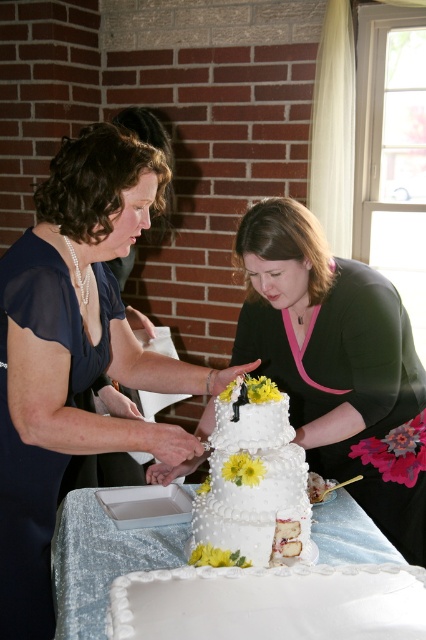
Question: Which object is farther from the camera taking this photo?

Choices:
 (A) white textured wedding cake at center
 (B) matte blue dress at center

Answer: (B)

Question: Which of the following is the farthest from the observer?

Choices:
 (A) matte black dress at center
 (B) white textured wedding cake at center

Answer: (A)

Question: Considering the relative positions of matte blue dress at center and matte black dress at center in the image provided, where is matte blue dress at center located with respect to matte black dress at center?

Choices:
 (A) above
 (B) below

Answer: (A)

Question: Considering the real-world distances, which object is farthest from the white sequined tablecloth at center?

Choices:
 (A) matte black dress at center
 (B) matte blue dress at center
 (C) white textured wedding cake at center

Answer: (A)

Question: Considering the relative positions of matte blue dress at center and white sequined tablecloth at center in the image provided, where is matte blue dress at center located with respect to white sequined tablecloth at center?

Choices:
 (A) below
 (B) above

Answer: (B)

Question: Can you confirm if matte black dress at center is positioned below white sequined tablecloth at center?

Choices:
 (A) no
 (B) yes

Answer: (A)